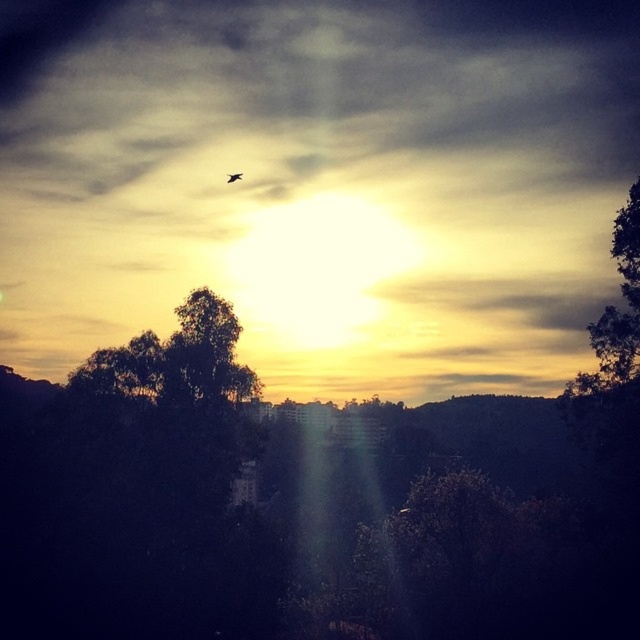
Find the location of a particular element. Image resolution: width=640 pixels, height=640 pixels. smokey gray cloud at upper center is located at coordinates (317, 182).

In the scene shown: Can you confirm if smokey gray cloud at upper center is taller than transparent glass plane at upper center?

Correct, smokey gray cloud at upper center is much taller as transparent glass plane at upper center.

Between point (292, 196) and point (241, 173), which one is positioned in front?

Point (241, 173) is more forward.

This screenshot has width=640, height=640. I want to click on smokey gray cloud at upper center, so click(317, 182).

What do you see at coordinates (204, 353) in the screenshot? I see `green leafy tree at center` at bounding box center [204, 353].

Does green leafy tree at center have a larger size compared to transparent glass plane at upper center?

Incorrect, green leafy tree at center is not larger than transparent glass plane at upper center.

Is point (225, 387) closer to camera compared to point (227, 180)?

Yes, point (225, 387) is in front of point (227, 180).

Find the location of `green leafy tree at center`. green leafy tree at center is located at coordinates [x=204, y=353].

Which of these two, smokey gray cloud at upper center or green leafy tree at center, stands taller?

Standing taller between the two is smokey gray cloud at upper center.

Can you confirm if smokey gray cloud at upper center is positioned above green leafy tree at center?

Indeed, smokey gray cloud at upper center is positioned over green leafy tree at center.

What do you see at coordinates (317, 182) in the screenshot? Image resolution: width=640 pixels, height=640 pixels. I see `smokey gray cloud at upper center` at bounding box center [317, 182].

I want to click on smokey gray cloud at upper center, so click(x=317, y=182).